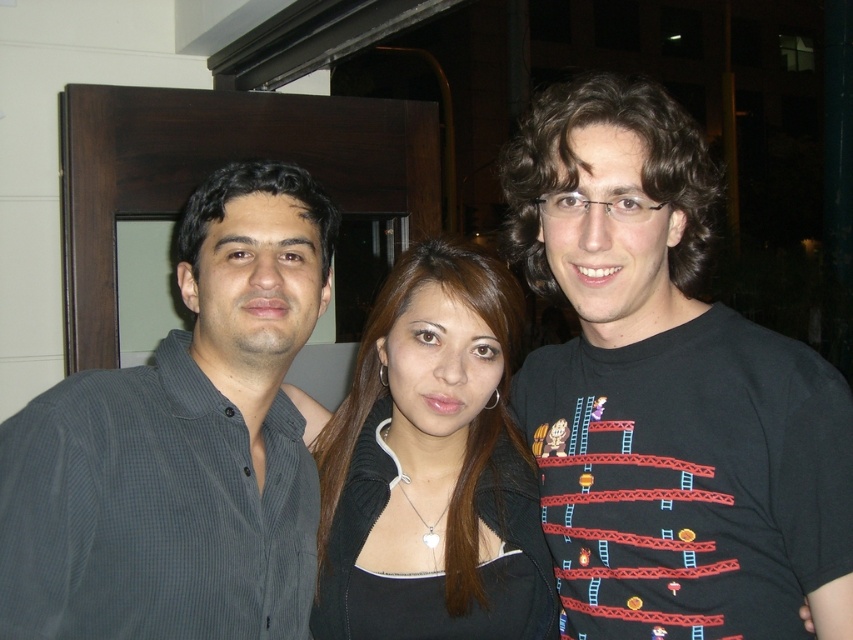
What do you see at coordinates (181, 445) in the screenshot?
I see `dark gray corduroy shirt at left` at bounding box center [181, 445].

Is dark gray corduroy shirt at left taller than black matte jacket at center?

Correct, dark gray corduroy shirt at left is much taller as black matte jacket at center.

Consider the image. Who is more forward, (x=274, y=260) or (x=535, y=516)?

Point (x=274, y=260) is in front.

The image size is (853, 640). I want to click on dark gray corduroy shirt at left, so click(181, 445).

Who is more distant from viewer, (596,634) or (151,474)?

Point (596,634)

Can you confirm if black cotton t-shirt at center is positioned to the left of dark gray corduroy shirt at left?

No, black cotton t-shirt at center is not to the left of dark gray corduroy shirt at left.

The image size is (853, 640). In order to click on black cotton t-shirt at center in this screenshot , I will do `click(666, 392)`.

Does black cotton t-shirt at center lie behind black matte jacket at center?

No, black cotton t-shirt at center is closer to the viewer.

Can you confirm if black cotton t-shirt at center is shorter than black matte jacket at center?

No.

Measure the distance between point (x=630, y=212) and camera.

Point (x=630, y=212) and camera are 3.37 feet apart.

The image size is (853, 640). Find the location of `black cotton t-shirt at center`. black cotton t-shirt at center is located at coordinates (666, 392).